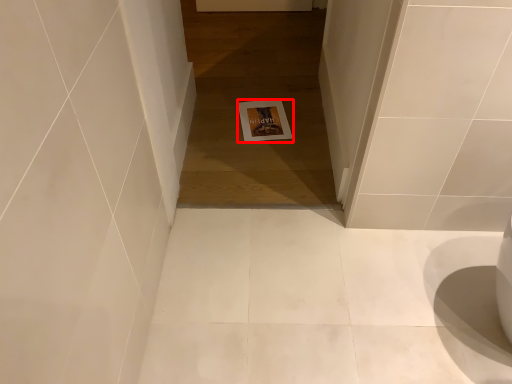
Question: Where is postcard (annotated by the red box) located in relation to passage in the image?

Choices:
 (A) right
 (B) left

Answer: (A)